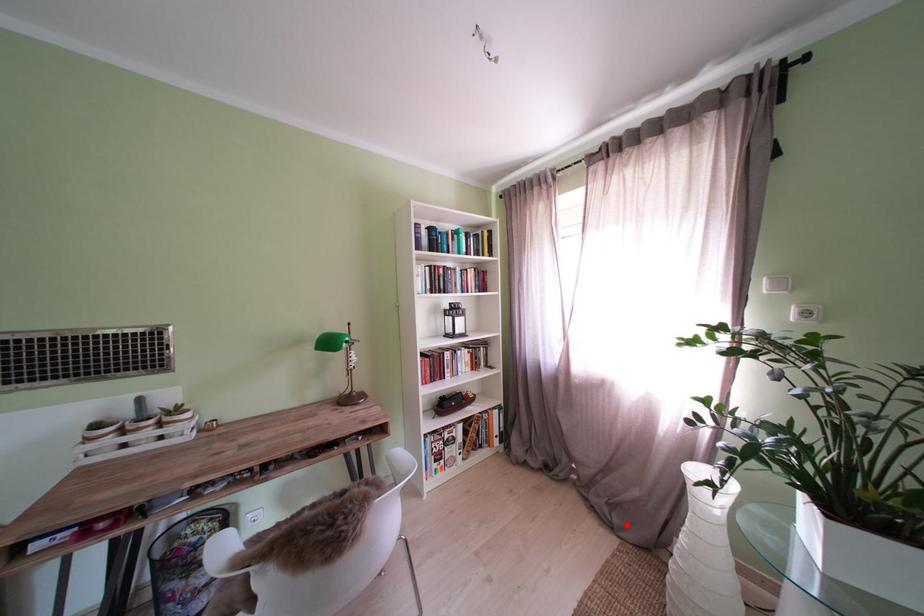
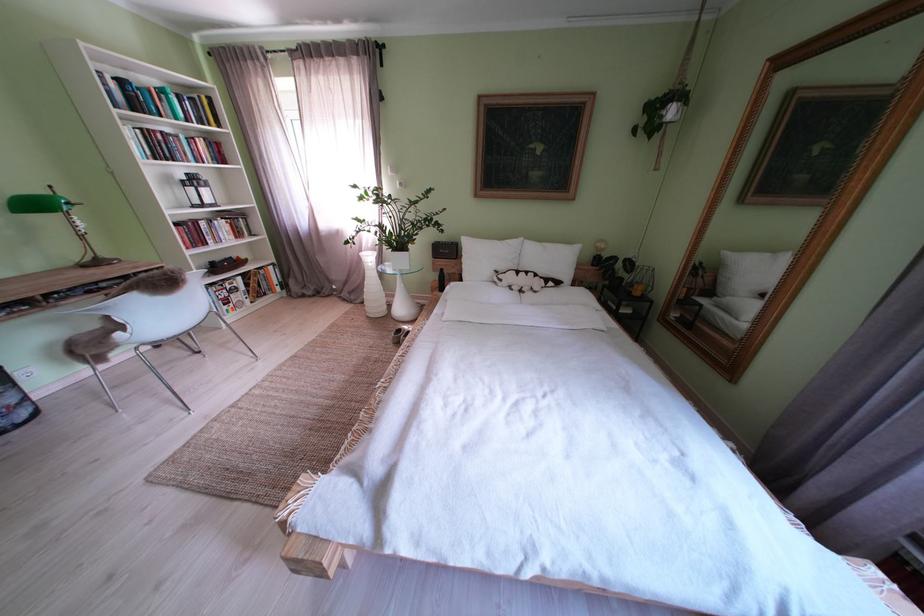
Question: I am providing you with two images of the same scene from different viewpoints. Image1 has a red point marked. In image2, the corresponding 3D location appears at what relative position? Reply with the corresponding letter.

Choices:
 (A) Closer
 (B) Farther

Answer: (B)